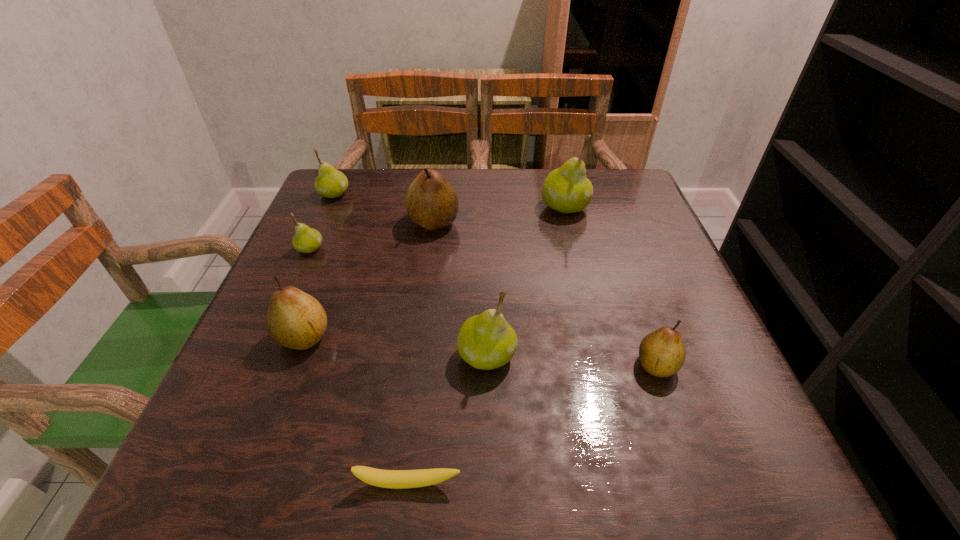
Locate an element on the screen. The width and height of the screenshot is (960, 540). the fifth nearest object is located at coordinates (306, 240).

Identify the location of the shortest object. (394, 479).

I want to click on the nearest object, so click(x=394, y=479).

The width and height of the screenshot is (960, 540). In order to click on free region located 0.110m on the back of the rightmost green pear in this screenshot , I will do `click(556, 173)`.

Identify the location of vacant space located 0.070m on the left of the farthest brown pear. (379, 222).

At what (x,y) coordinates should I click in order to perform the action: click on free space located on the right of the second green pear from right to left. Please return your answer as a coordinate pair (x, y). Looking at the image, I should click on (613, 356).

At what (x,y) coordinates should I click in order to perform the action: click on free spot located on the front of the second smallest green pear. Please return your answer as a coordinate pair (x, y). Looking at the image, I should click on (277, 322).

This screenshot has height=540, width=960. I want to click on vacant space situated 0.290m on the back of the leftmost brown pear, so click(x=345, y=226).

At what (x,y) coordinates should I click in order to perform the action: click on free space located 0.240m on the left of the smallest brown pear. Please return your answer as a coordinate pair (x, y). The image size is (960, 540). Looking at the image, I should click on (495, 365).

At what (x,y) coordinates should I click in order to perform the action: click on vacant space located 0.170m on the front of the fourth farthest pear. Please return your answer as a coordinate pair (x, y). Looking at the image, I should click on (281, 315).